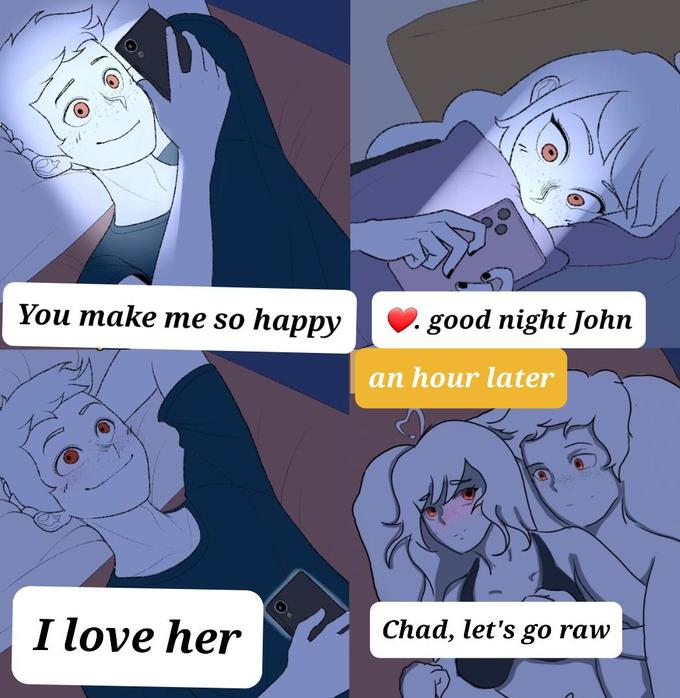
I want to click on pillow, so click(x=39, y=195), click(x=26, y=560).